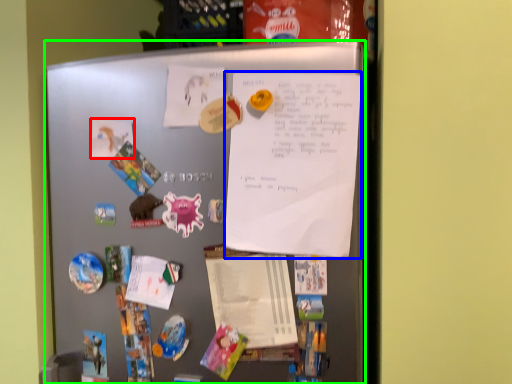
Question: Estimate the real-world distances between objects in this image. Which object is farther from paper (highlighted by a red box), poster (highlighted by a blue box) or refrigerator (highlighted by a green box)?

Choices:
 (A) poster
 (B) refrigerator

Answer: (A)